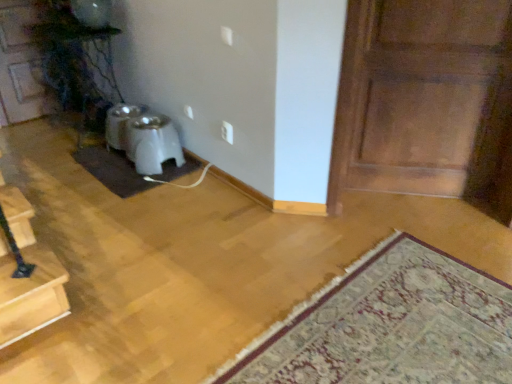
Locate an element on the screen. free space to the left of carpeted rug at lower right is located at coordinates (x=179, y=292).